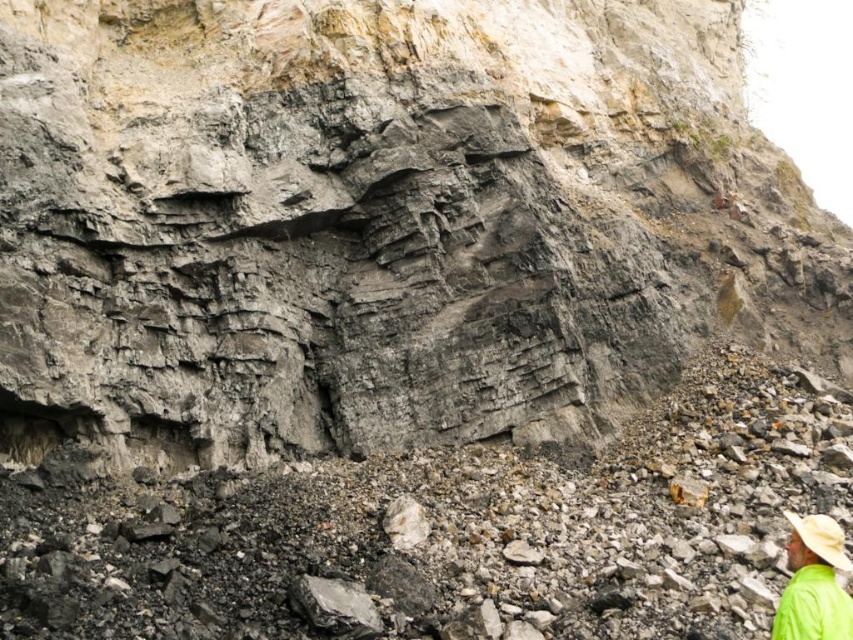
You are standing at the base of the cliff and see the green fabric hat at lower right and the beige straw hat at lower right. If you want to pick up both hats, which one should you reach for first to minimize the distance you have to walk?

Both the green fabric hat at lower right and the beige straw hat at lower right are located at the lower right area of the scene. Since they are only 3.50 feet apart, you can reach for either one first without needing to walk much distance between them.

You are a hiker who has just reached the base of the cliff and notices both the green fabric hat at lower right and the beige straw hat at lower right. Which hat is located closer to the ground?

The green fabric hat at lower right is positioned under the beige straw hat at lower right, so it is closer to the ground.

You are standing at the base of the cliff and see the green fabric hat at lower right and the beige straw hat at lower right. Which hat has a larger width?

The green fabric hat at lower right might be wider than the beige straw hat at lower right, so it could have a larger width.